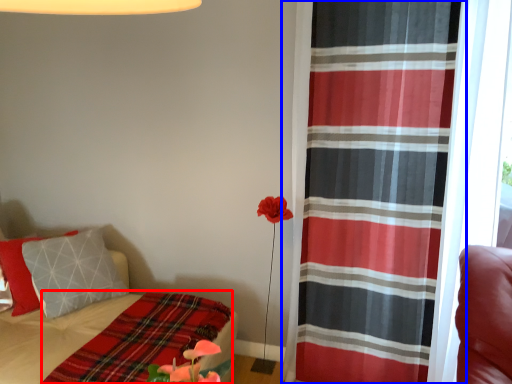
Question: Which of the following is the farthest to the observer, blanket (highlighted by a red box) or curtain (highlighted by a blue box)?

Choices:
 (A) blanket
 (B) curtain

Answer: (B)